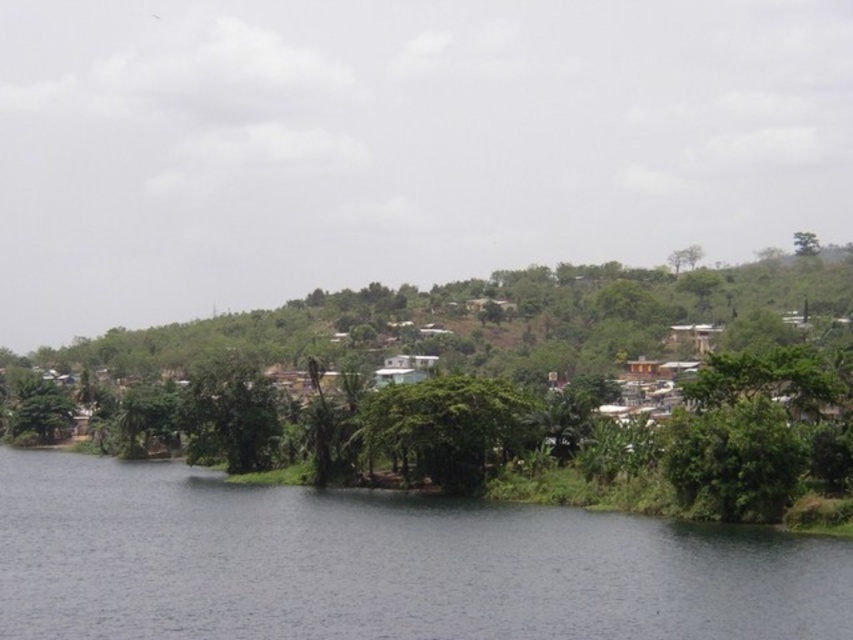
Question: Which of the following is the closest to the observer?

Choices:
 (A) green leafy tree at upper right
 (B) green leafy tree at center

Answer: (B)

Question: Considering the real-world distances, which object is closest to the dark gray water at center?

Choices:
 (A) green leafy tree at lower right
 (B) green leafy tree at center
 (C) green leafy tree at upper right

Answer: (A)

Question: Does dark gray water at center appear on the right side of green leafy tree at lower right?

Choices:
 (A) no
 (B) yes

Answer: (A)

Question: Which point is farther to the camera?

Choices:
 (A) (363, 552)
 (B) (364, 400)
 (C) (727, 428)
 (D) (795, 250)

Answer: (D)

Question: Is green leafy tree at center above green leafy tree at upper right?

Choices:
 (A) yes
 (B) no

Answer: (B)

Question: Does green leafy tree at lower right appear on the right side of green leafy tree at upper right?

Choices:
 (A) yes
 (B) no

Answer: (B)